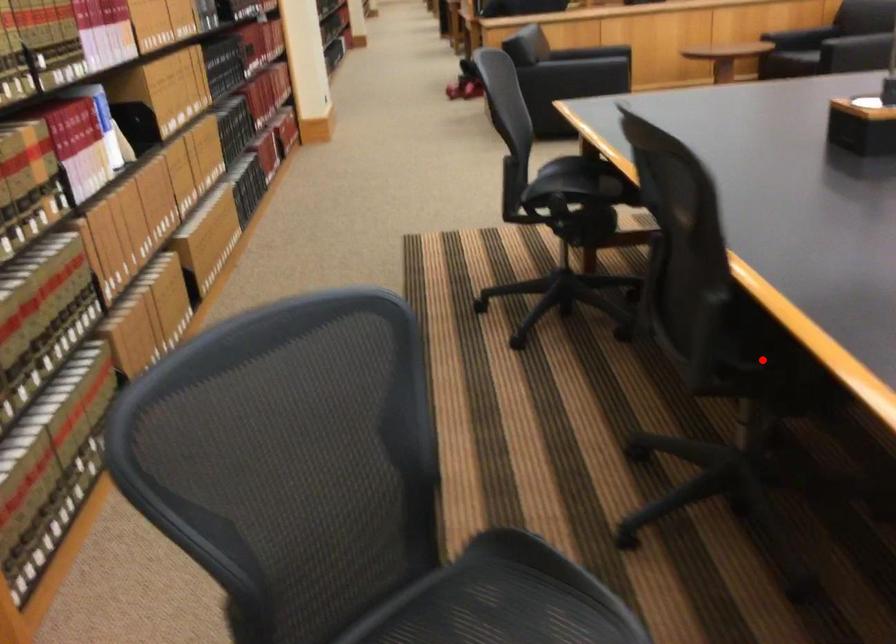
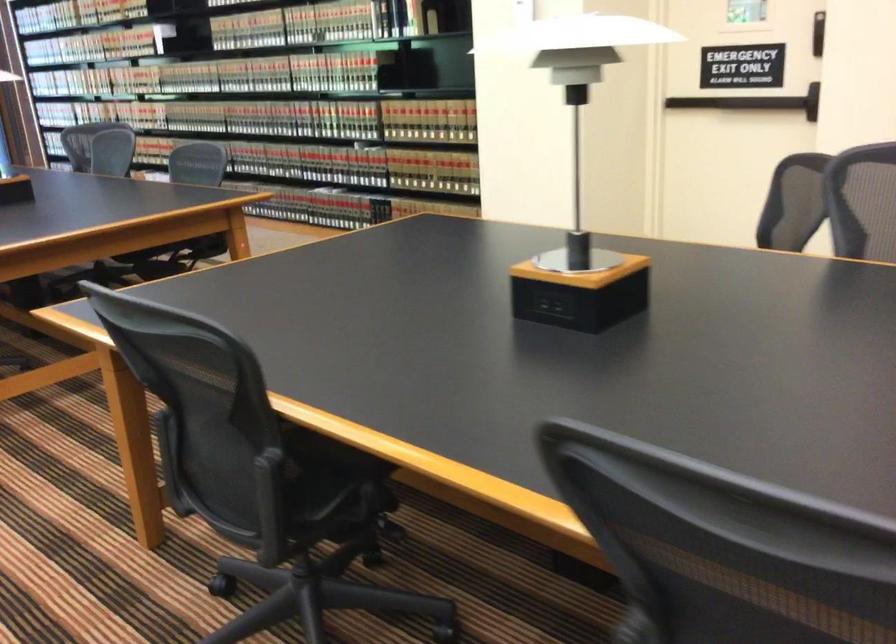
Question: I am providing you with two images of the same scene from different viewpoints. A red point is marked on the first image. Can you still see the location of the red point in image 2?

Choices:
 (A) Yes
 (B) No

Answer: (B)